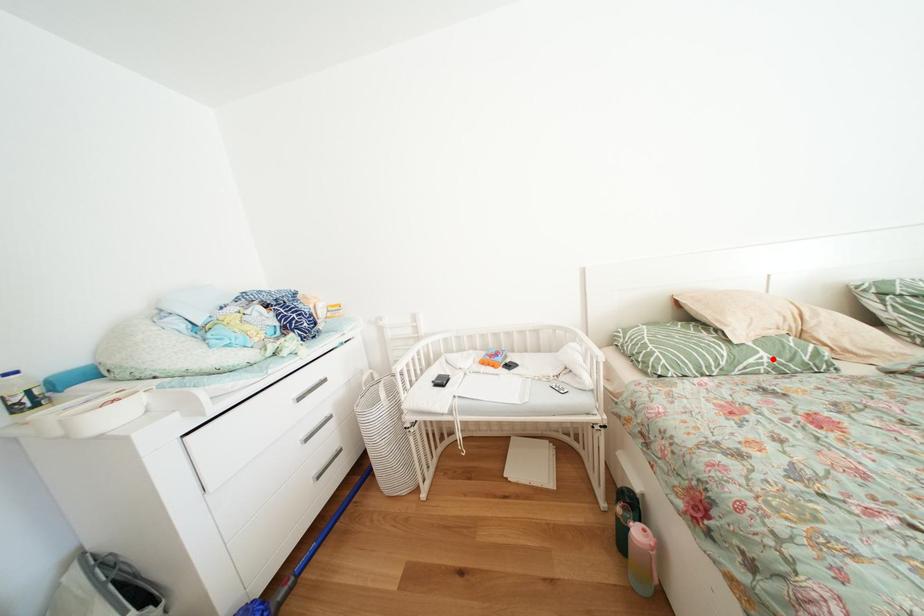
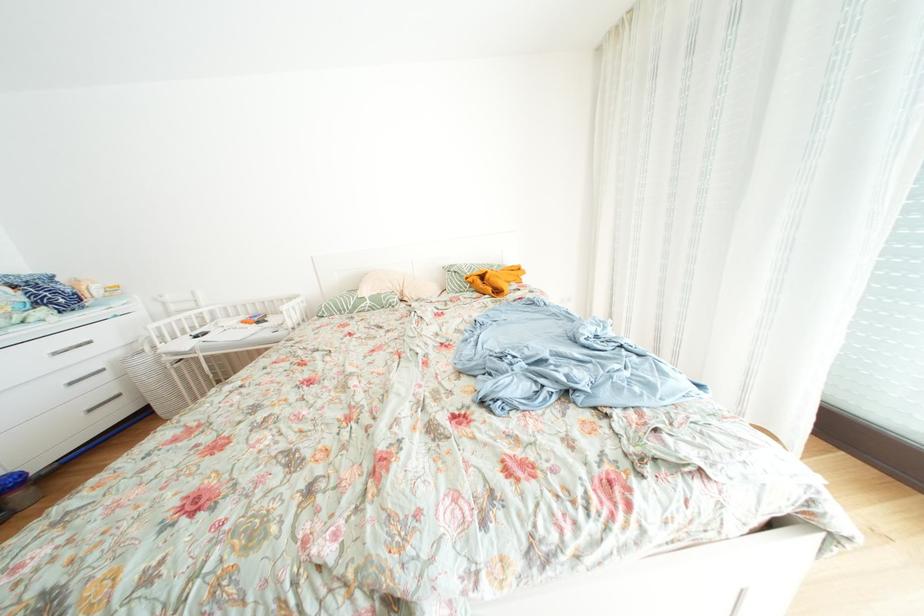
Locate, in the second image, the point that corresponds to the highlighted location in the first image.

(378, 307)